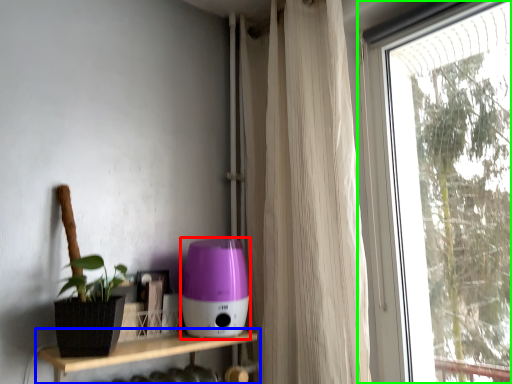
Question: Which is nearer to the appliance (highlighted by a red box)? shelf (highlighted by a blue box) or window (highlighted by a green box).

Choices:
 (A) shelf
 (B) window

Answer: (A)